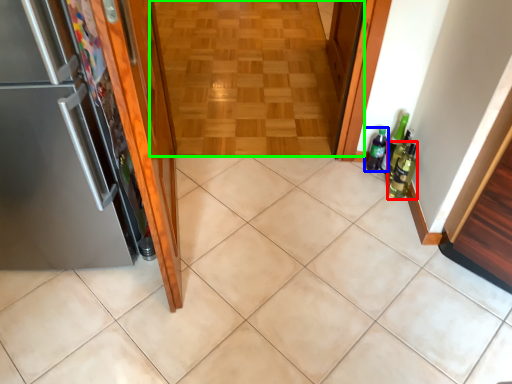
Question: Considering the real-world distances, which object is farthest from beer bottle (highlighted by a red box)? bottle (highlighted by a blue box) or corridor (highlighted by a green box)?

Choices:
 (A) bottle
 (B) corridor

Answer: (B)